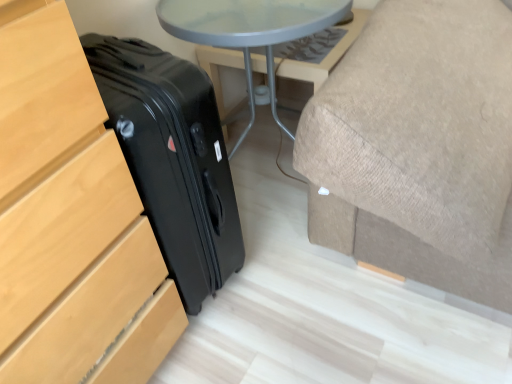
Find the location of `unoccupied region to the right of black plastic suitcase at left`. unoccupied region to the right of black plastic suitcase at left is located at coordinates (295, 291).